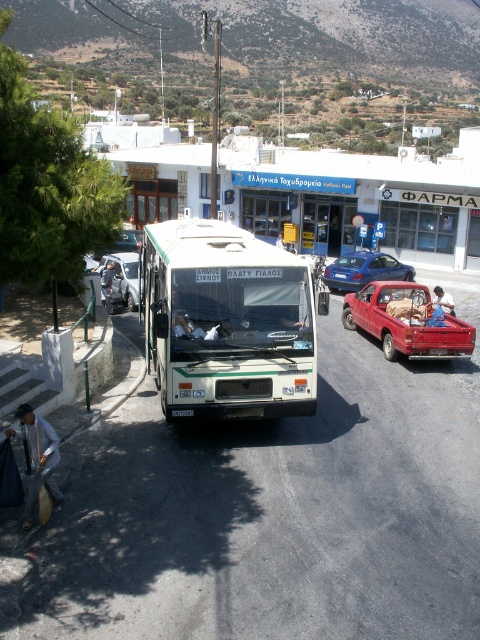
Where is `white matte tour bus at center`? Image resolution: width=480 pixels, height=640 pixels. white matte tour bus at center is located at coordinates (225, 323).

Is white matte tour bus at center positioned behind silver metallic car at left?

That is False.

At what (x,y) coordinates should I click in order to perform the action: click on white matte tour bus at center. Please return your answer as a coordinate pair (x, y). This screenshot has width=480, height=640. Looking at the image, I should click on (225, 323).

The image size is (480, 640). I want to click on white matte tour bus at center, so click(225, 323).

Who is lower down, silver metallic car at left or light blue jeans at center?

Positioned lower is light blue jeans at center.

This screenshot has height=640, width=480. What do you see at coordinates (121, 276) in the screenshot?
I see `silver metallic car at left` at bounding box center [121, 276].

This screenshot has width=480, height=640. Find the location of `silver metallic car at left`. silver metallic car at left is located at coordinates (121, 276).

This screenshot has width=480, height=640. Identify the location of silver metallic car at left. (121, 276).

Who is positioned more to the right, white matte tour bus at center or blue metallic sedan at center?

From the viewer's perspective, blue metallic sedan at center appears more on the right side.

Can you confirm if white matte tour bus at center is smaller than blue metallic sedan at center?

Yes.

Does point (240, 257) lie in front of point (381, 256)?

Yes, it is.

This screenshot has height=640, width=480. Find the location of `white matte tour bus at center`. white matte tour bus at center is located at coordinates 225,323.